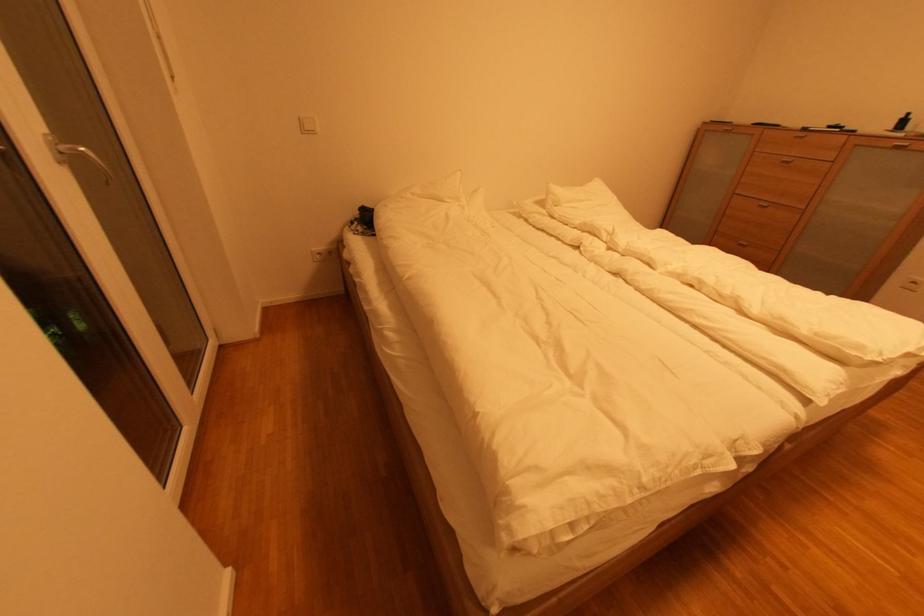
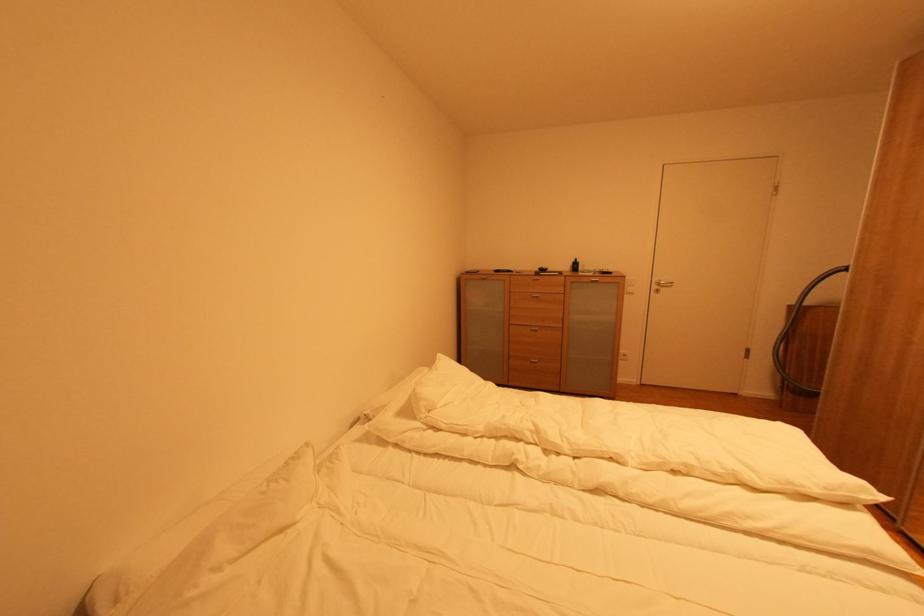
Where in the second image is the point corresponding to (767,207) from the first image?

(539, 331)